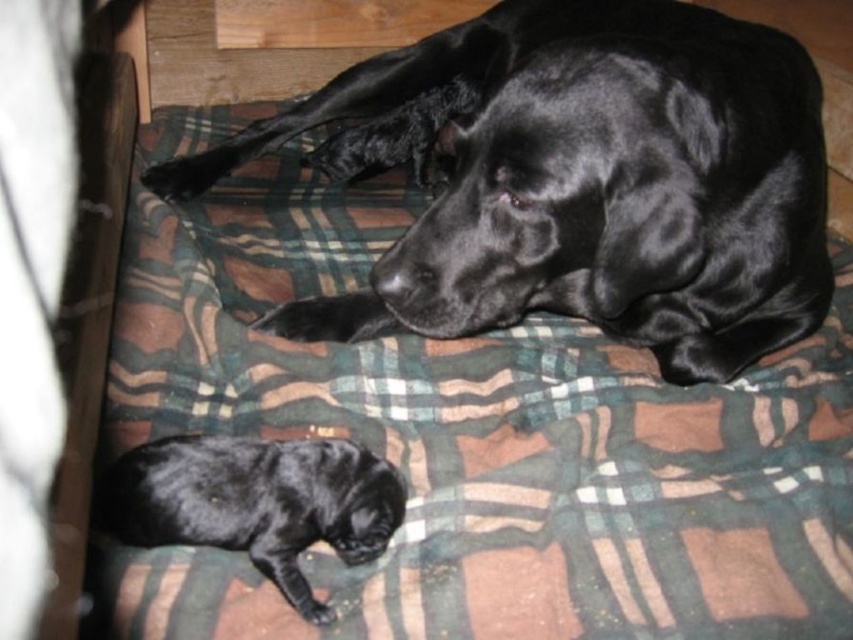
You are standing in front of the image and want to touch both the point at position (x=810, y=276) and the point at position (x=186, y=445). Which point should you reach for first to touch the one closer to you?

The point at position (x=810, y=276) is closer to you than the point at position (x=186, y=445), so you should reach for the point at (x=810, y=276) first.

You are a photographer trying to capture both the shiny black dog at center and the shiny black puppy at lower left in a single frame. Based on their positions, which direction should you move your camera to include both subjects?

You should move your camera to the left to include both the shiny black dog at center and the shiny black puppy at lower left since the shiny black dog at center is to the right of the shiny black puppy at lower left.